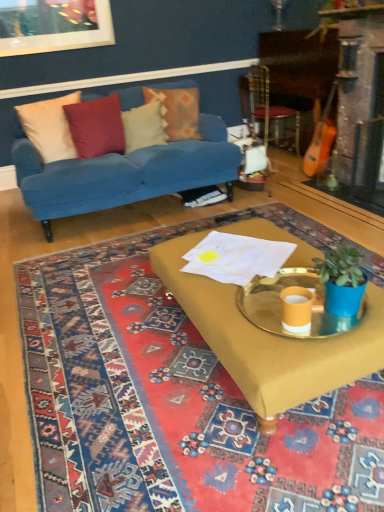
Question: Which direction should I rotate to face white soft pillow at upper center, marked as the second pillow in a right-to-left arrangement, — up or down?

Choices:
 (A) down
 (B) up

Answer: (B)

Question: Is velvet blue couch at upper left oriented away from beige fabric pillow at left, positioned as the fourth pillow in right-to-left order?

Choices:
 (A) yes
 (B) no

Answer: (A)

Question: From a real-world perspective, is velvet blue couch at upper left on beige fabric pillow at left, the 1th pillow viewed from the left?

Choices:
 (A) no
 (B) yes

Answer: (A)

Question: Are velvet blue couch at upper left and beige fabric pillow at left, positioned as the fourth pillow in right-to-left order, located far from each other?

Choices:
 (A) no
 (B) yes

Answer: (A)

Question: Can you confirm if velvet blue couch at upper left is thinner than beige fabric pillow at left, positioned as the fourth pillow in right-to-left order?

Choices:
 (A) no
 (B) yes

Answer: (A)

Question: From the image's perspective, is velvet blue couch at upper left below beige fabric pillow at left, the 1th pillow viewed from the left?

Choices:
 (A) no
 (B) yes

Answer: (B)

Question: From the image's perspective, would you say velvet blue couch at upper left is positioned over beige fabric pillow at left, the 1th pillow viewed from the left?

Choices:
 (A) no
 (B) yes

Answer: (A)

Question: From the image's perspective, is mustard fabric coffee table at center under metallic gold tray at center?

Choices:
 (A) no
 (B) yes

Answer: (B)

Question: Is mustard fabric coffee table at center completely or partially outside of metallic gold tray at center?

Choices:
 (A) yes
 (B) no

Answer: (A)

Question: Is mustard fabric coffee table at center directly adjacent to metallic gold tray at center?

Choices:
 (A) yes
 (B) no

Answer: (B)

Question: From the image's perspective, is mustard fabric coffee table at center on top of metallic gold tray at center?

Choices:
 (A) yes
 (B) no

Answer: (B)

Question: From a real-world perspective, is mustard fabric coffee table at center positioned under metallic gold tray at center based on gravity?

Choices:
 (A) yes
 (B) no

Answer: (A)

Question: Is metallic gold tray at center inside mustard fabric coffee table at center?

Choices:
 (A) yes
 (B) no

Answer: (A)

Question: Can you see beige fabric pillow at left, the 1th pillow viewed from the left, touching blue matte plant pot at right?

Choices:
 (A) no
 (B) yes

Answer: (A)